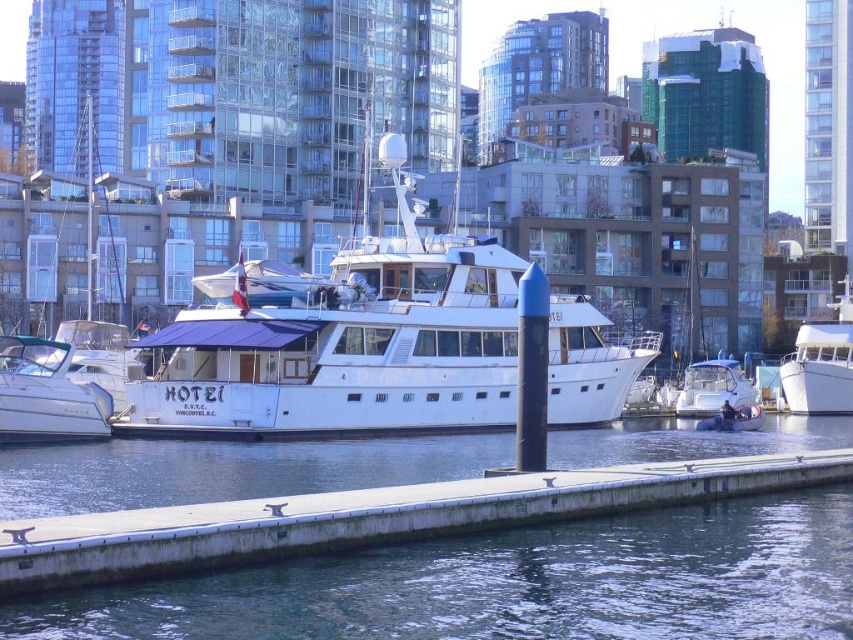
You are standing at the edge of the marina and notice a point marked at coordinates (514, 584). What is located at this point?

The point at coordinates (514, 584) is clear water at dock center.

You are standing at the marina and want to board the white glossy boat at right. Considering the distance between you and the boat, can you safely walk directly to it without needing a bridge or ramp?

The white glossy boat at right is 83.59 meters away from the viewer. Since this distance is quite large, you would likely need a bridge or ramp to safely reach it, as walking directly might be impractical due to the water in between.

In the scene shown: You are standing at the edge of the dock and want to take a photo of both the clear water at dock center and the white glossy motorboat at lower right. Which object will appear larger in your photo?

The clear water at dock center will appear larger in the photo because it is closer to the viewer than the white glossy motorboat at lower right.